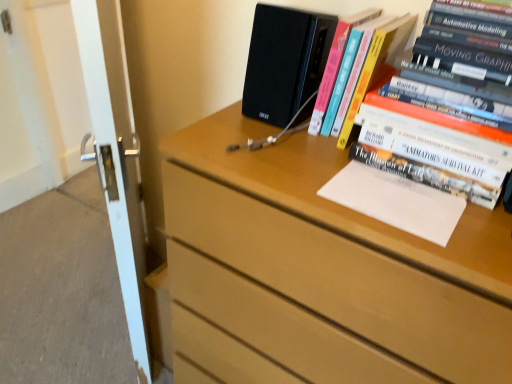
Locate an element on the screen. This screenshot has width=512, height=384. vacant space underneath white paper at upper right (from a real-world perspective) is located at coordinates (388, 192).